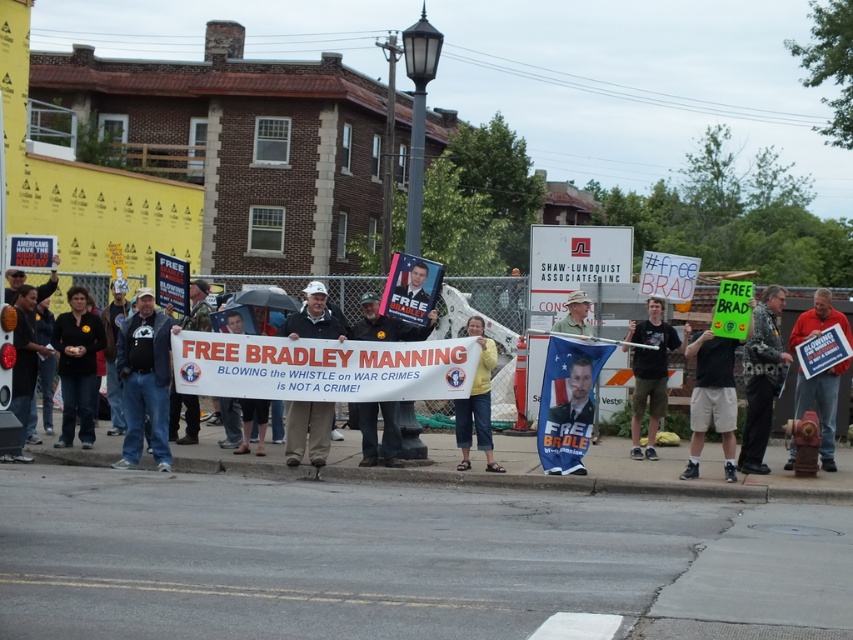
Is point (755, 390) closer to viewer compared to point (635, 436)?

Yes, it is.

Can you confirm if camouflage jacket at center is positioned below black cotton shirt at center?

Yes.

Between point (786, 364) and point (641, 392), which one is positioned in front?

Point (786, 364) is more forward.

The image size is (853, 640). What are the coordinates of `camouflage jacket at center` in the screenshot? It's located at (761, 378).

From the picture: Which is above, dark blue jeans at center or yellow matte shirt at center?

dark blue jeans at center is higher up.

Does dark blue jeans at center lie in front of yellow matte shirt at center?

That is False.

You are a GUI agent. You are given a task and a screenshot of the screen. Output one action in this format:
    pyautogui.click(x=<x>, y=<y>)
    Task: Click on the dark blue jeans at center
    The image size is (853, 640).
    Given the screenshot: What is the action you would take?
    pyautogui.click(x=144, y=381)

Who is shorter, dark blue jeans at center or black matte sign at center?

Standing shorter between the two is black matte sign at center.

Is dark blue jeans at center shorter than black matte sign at center?

No, dark blue jeans at center is not shorter than black matte sign at center.

Identify the location of dark blue jeans at center. The image size is (853, 640). (144, 381).

This screenshot has height=640, width=853. What are the coordinates of `dark blue jeans at center` in the screenshot? It's located at (144, 381).